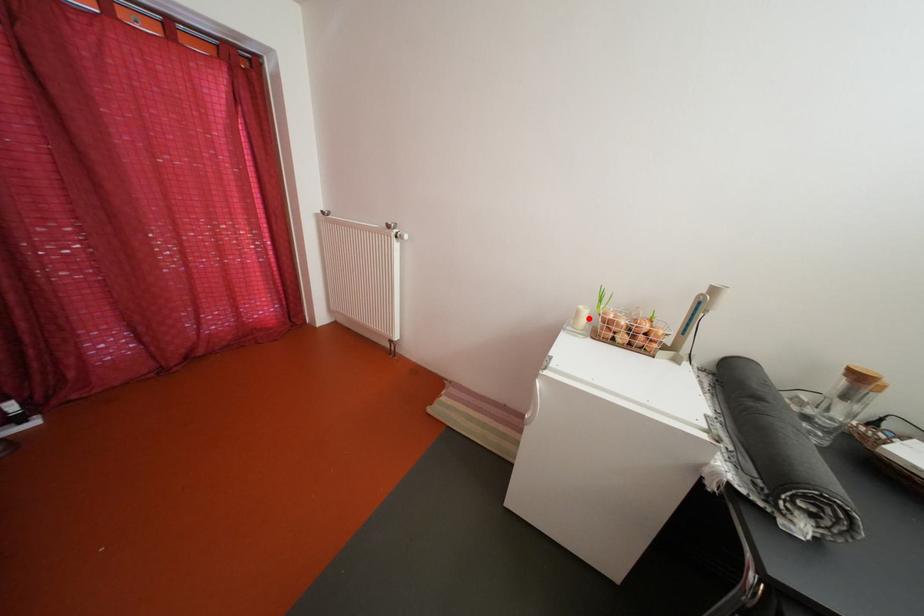
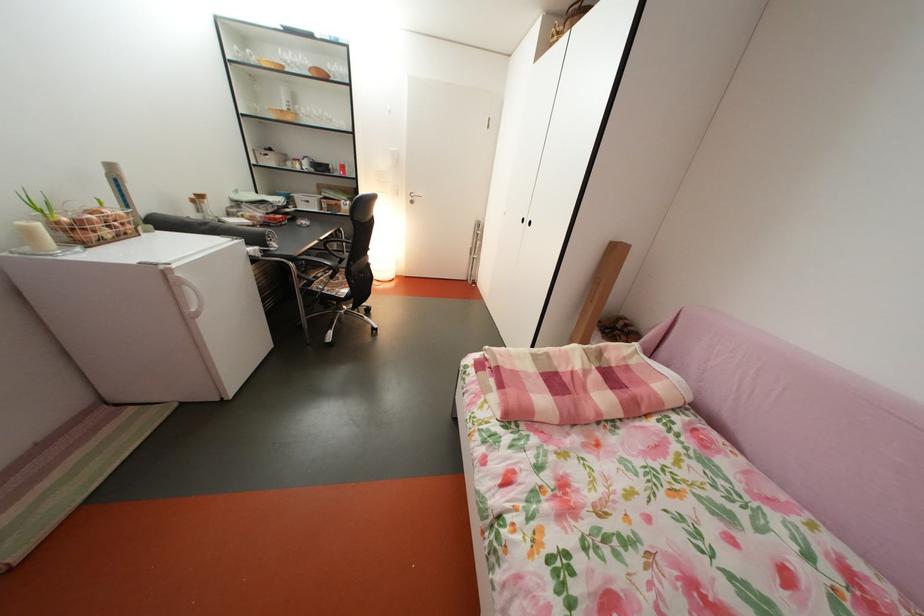
Where in the second image is the point corresponding to the highlighted location from the first image?

(41, 238)